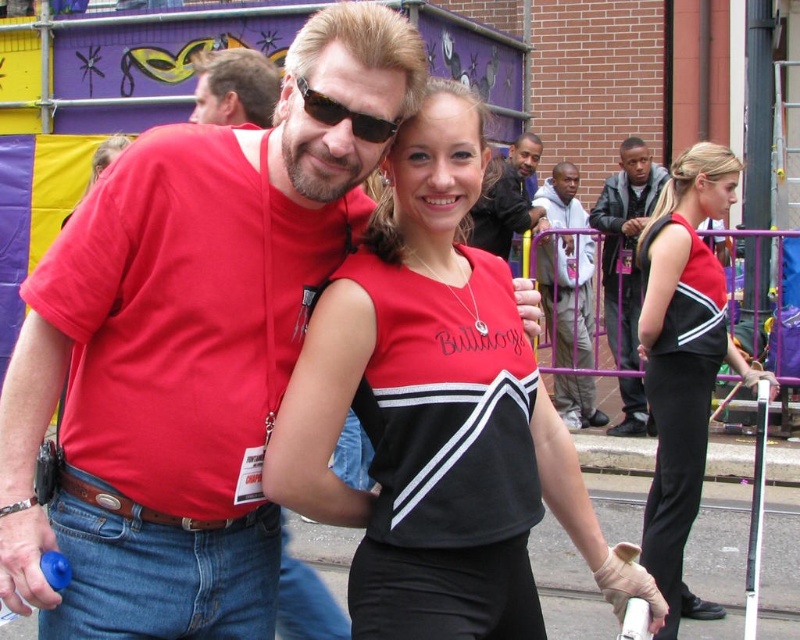
Question: Does matte red t-shirt at center come in front of sunglasses at center?

Choices:
 (A) yes
 (B) no

Answer: (A)

Question: Which object appears closest to the camera in this image?

Choices:
 (A) sunglasses at center
 (B) matte black uniform at right
 (C) black leather jacket at right

Answer: (A)

Question: Which object is farther from the camera taking this photo?

Choices:
 (A) matte black cheerleader uniform at center
 (B) matte black shirt at center
 (C) matte red shirt at upper left
 (D) gray cotton hoodie at center

Answer: (D)

Question: Based on their relative distances, which object is nearer to the sunglasses at center?

Choices:
 (A) matte black shirt at center
 (B) black leather jacket at right
 (C) matte red t-shirt at center

Answer: (C)

Question: Does matte red t-shirt at center have a smaller size compared to sunglasses at center?

Choices:
 (A) no
 (B) yes

Answer: (A)

Question: Does matte red t-shirt at center appear on the left side of sunglasses at center?

Choices:
 (A) yes
 (B) no

Answer: (A)